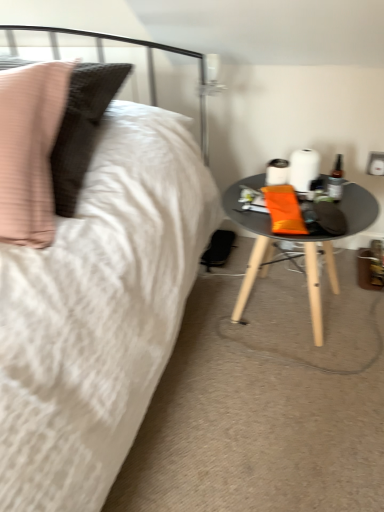
The height and width of the screenshot is (512, 384). Identify the location of free location in front of matte black table at lower right. (284, 411).